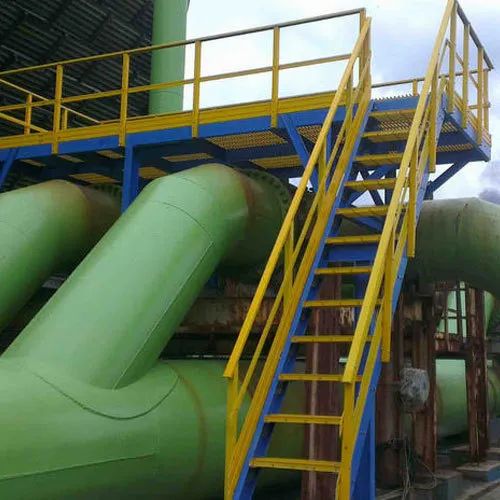
Identify the location of 2nd stair. (330, 418).